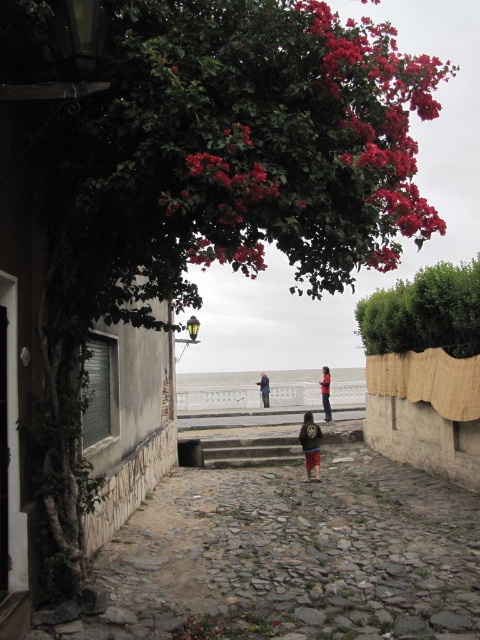
Question: Can you confirm if dark brown leather jacket at center is positioned to the right of dark blue jacket at center?

Choices:
 (A) yes
 (B) no

Answer: (A)

Question: Does red fabric jacket at center appear over dark blue jacket at center?

Choices:
 (A) no
 (B) yes

Answer: (B)

Question: Does green leafy bush at center lie behind red fabric jacket at center?

Choices:
 (A) no
 (B) yes

Answer: (A)

Question: Which object appears farthest from the camera in this image?

Choices:
 (A) dark blue jacket at center
 (B) smooth concrete steps at center
 (C) green leafy bush at center

Answer: (B)

Question: Which is farther from the red fabric jacket at center?

Choices:
 (A) smooth concrete steps at center
 (B) dark blue jacket at center

Answer: (A)

Question: Which point is farther from the camera taking this photo?

Choices:
 (A) (319, 433)
 (B) (264, 372)

Answer: (B)